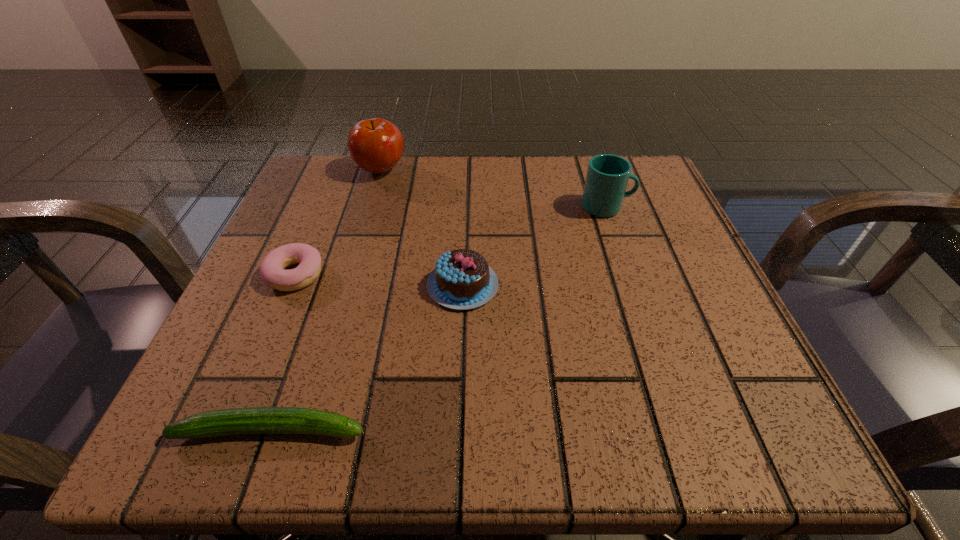
Identify the location of the farthest object. Image resolution: width=960 pixels, height=540 pixels. (376, 145).

You are a GUI agent. You are given a task and a screenshot of the screen. Output one action in this format:
    pyautogui.click(x=<x>, y=<y>)
    Task: Click on the apple
    The width and height of the screenshot is (960, 540).
    Given the screenshot: What is the action you would take?
    pyautogui.click(x=376, y=145)

Where is `cup`? Image resolution: width=960 pixels, height=540 pixels. cup is located at coordinates (607, 176).

The width and height of the screenshot is (960, 540). I want to click on the fourth nearest object, so click(x=607, y=176).

You are a GUI agent. You are given a task and a screenshot of the screen. Output one action in this format:
    pyautogui.click(x=<x>, y=<y>)
    Task: Click on the third tallest object
    
    Given the screenshot: What is the action you would take?
    pyautogui.click(x=462, y=280)

This screenshot has height=540, width=960. Identify the location of the fourth object from left to right. (462, 280).

Identify the location of the fourth tallest object. The image size is (960, 540). point(272,271).

You are a GUI agent. You are given a task and a screenshot of the screen. Output one action in this format:
    pyautogui.click(x=<x>, y=<y>)
    Task: Click on the shortest object
    Image resolution: width=960 pixels, height=540 pixels.
    Given the screenshot: What is the action you would take?
    pyautogui.click(x=255, y=420)

Identify the location of the nearest object. The image size is (960, 540). click(x=255, y=420).

At what (x,y) coordinates should I click in order to perform the action: click on blank space located 0.060m on the front of the farthest object. Please return your answer as a coordinate pair (x, y). Looking at the image, I should click on (372, 201).